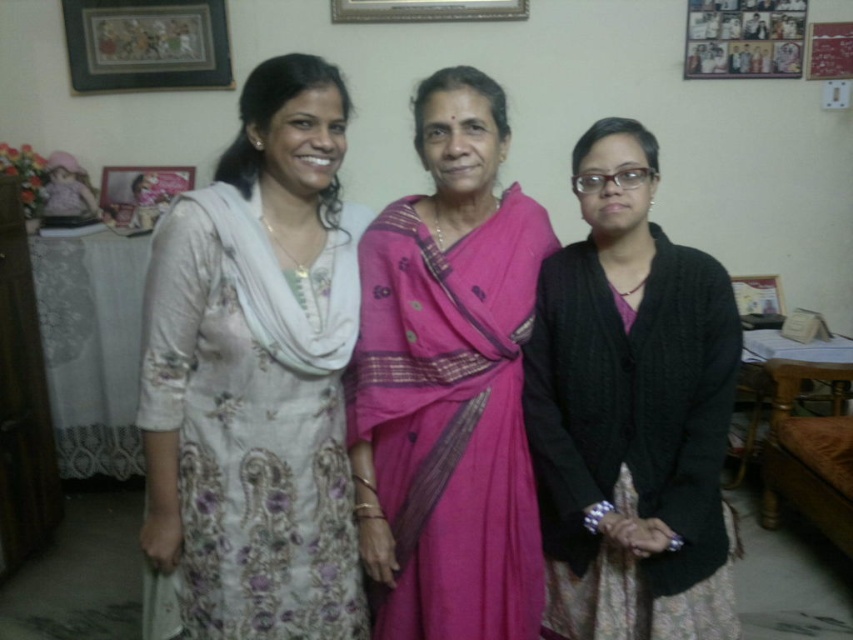
You are standing in a room with three women. You notice two points marked in the scene. The first point is at coordinate point(x=122, y=216) and the second is at point(x=430, y=16). Which point is closer to you?

Point(x=122, y=216) is closer to you because it is further to the viewer than point(x=430, y=16).

You are a photographer setting up for a family photo. You need to position two picture frames so that there is at least 1 meter of space between them for a tripod. Are the wooden picture frame at upper left and the metallic silver picture frame at upper center positioned correctly?

The wooden picture frame at upper left is 1.03 meters away from the metallic silver picture frame at upper center, which meets the requirement of at least 1 meter of space. Therefore, they are positioned correctly for the tripod.

You are a tailor who needs to determine if the black knitted cardigan at center can fit into a storage box designed for items smaller than the wooden photo frame at upper right. Can the cardigan fit?

The black knitted cardigan at center is larger in size than the wooden photo frame at upper right, so it cannot fit into the storage box designed for items smaller than the wooden photo frame at upper right.